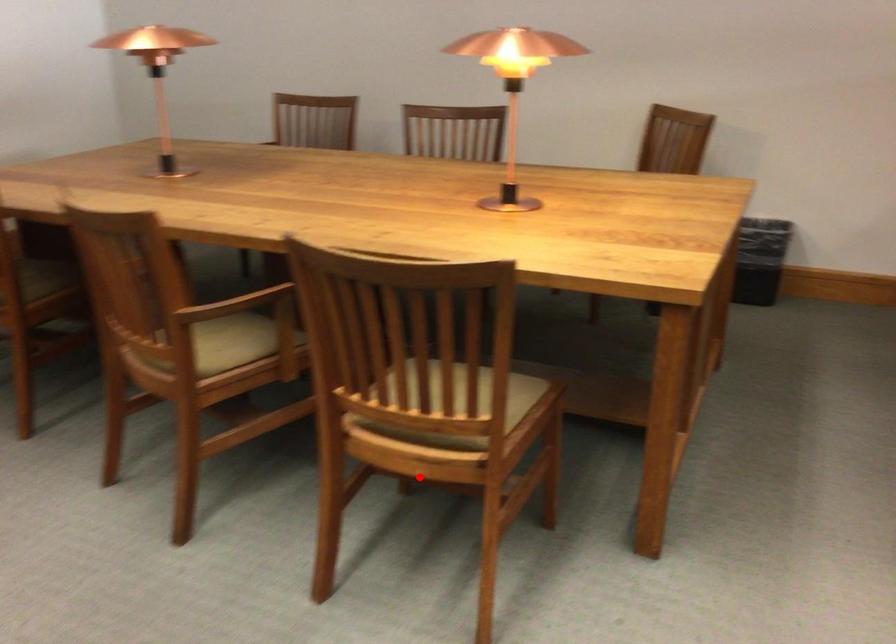
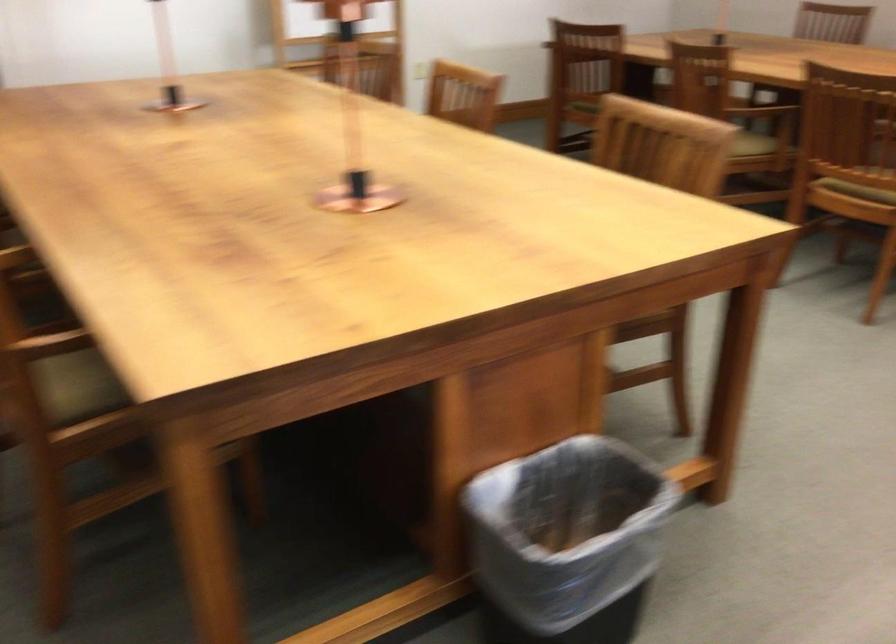
Question: I am providing you with two images of the same scene from different viewpoints. A red point is marked on the first image. Is the red point's position out of view in image 2?

Choices:
 (A) Yes
 (B) No

Answer: (B)